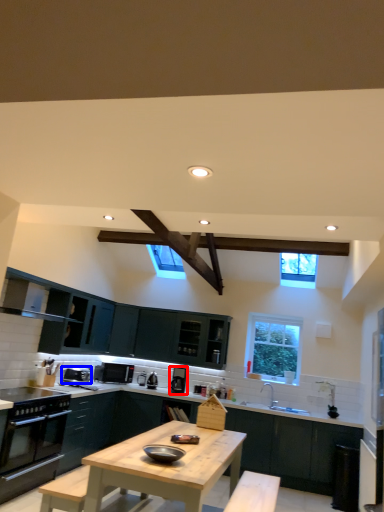
Question: Which of the following is the farthest to the observer, appliance (highlighted by a red box) or appliance (highlighted by a blue box)?

Choices:
 (A) appliance
 (B) appliance

Answer: (A)